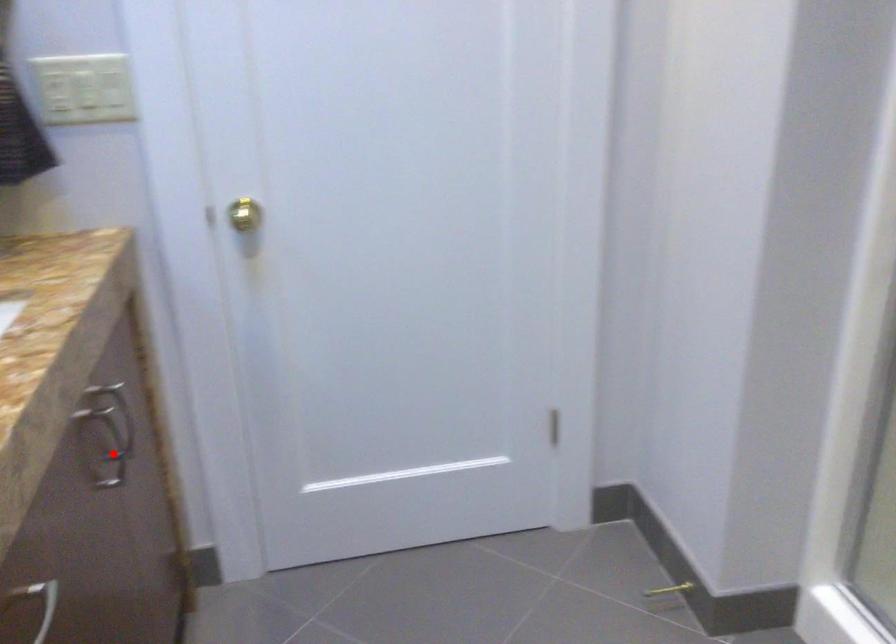
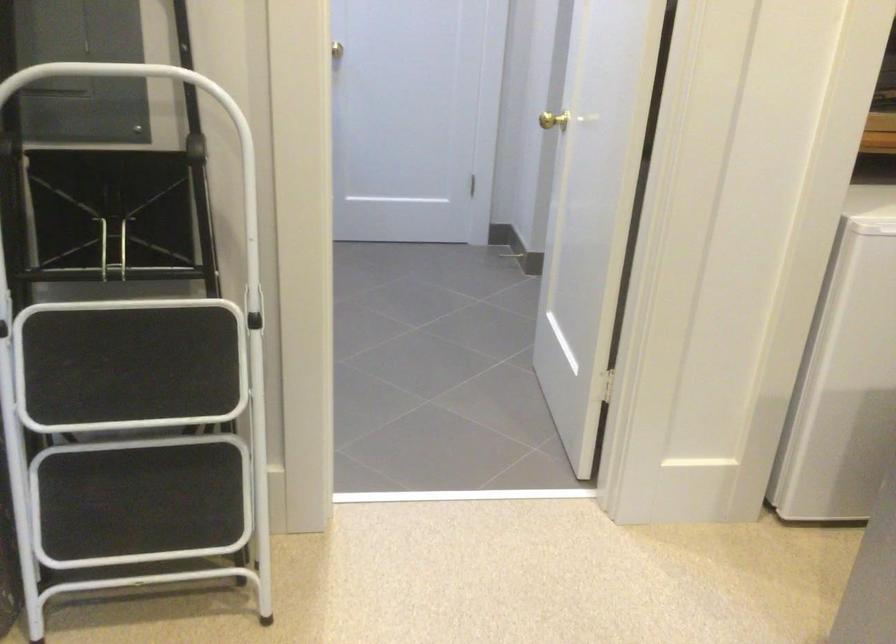
Question: I am providing you with two images of the same scene from different viewpoints. A red point is marked on the first image. At the location where the point appears in image 1, is it still visible in image 2?

Choices:
 (A) Yes
 (B) No

Answer: (B)